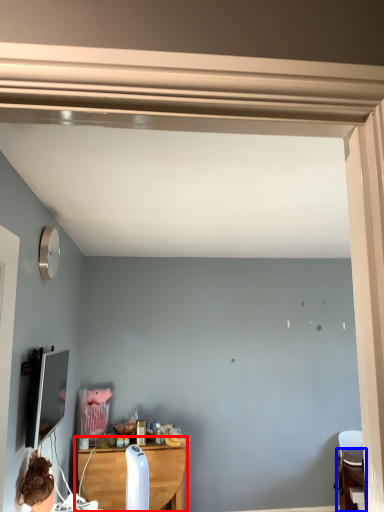
Question: Which point is closer to the camera, table (highlighted by a red box) or table (highlighted by a blue box)?

Choices:
 (A) table
 (B) table

Answer: (A)